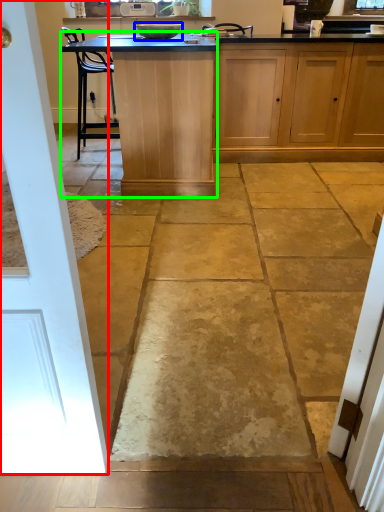
Question: Estimate the real-world distances between objects in this image. Which object is closer to door (highlighted by a red box), appliance (highlighted by a blue box) or table (highlighted by a green box)?

Choices:
 (A) appliance
 (B) table

Answer: (B)